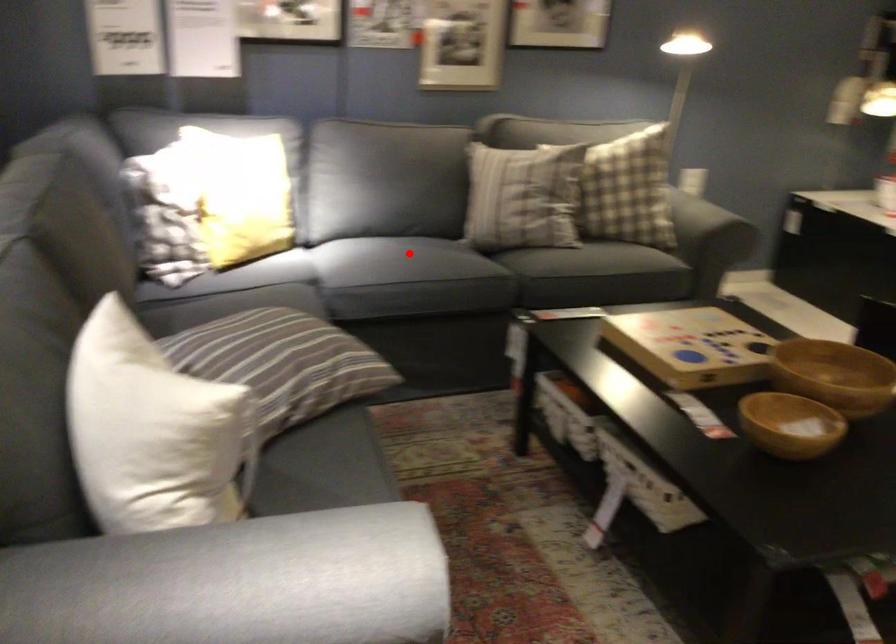
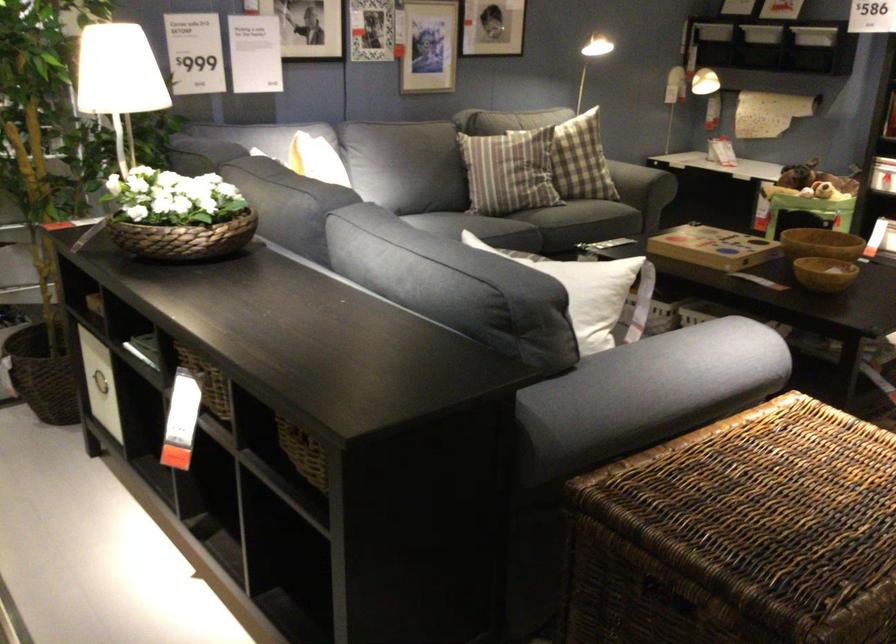
Find the pixel in the second image that matches the highlighted location in the first image.

(484, 227)